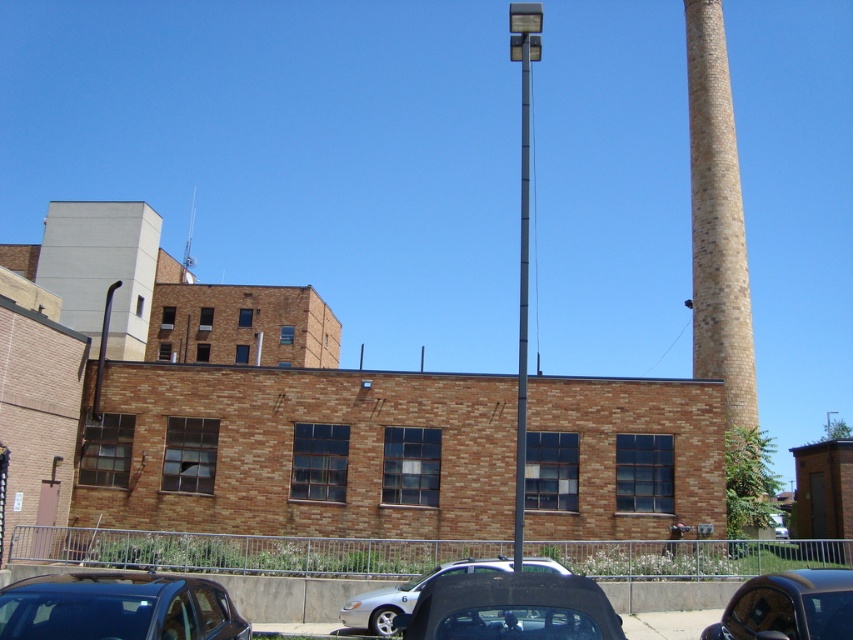
Question: Does shiny black car at lower right appear on the left side of metallic gray pole at center?

Choices:
 (A) yes
 (B) no

Answer: (A)

Question: Can you confirm if shiny black car at lower right is positioned to the right of metallic gray pole at center?

Choices:
 (A) yes
 (B) no

Answer: (B)

Question: Can you confirm if shiny blue car at lower left is positioned to the right of metallic gray pole at center?

Choices:
 (A) no
 (B) yes

Answer: (A)

Question: Which point is closer to the camera taking this photo?

Choices:
 (A) (384, 618)
 (B) (521, 244)
 (C) (793, 636)

Answer: (C)

Question: Estimate the real-world distances between objects in this image. Which object is farther from the shiny blue car at lower left?

Choices:
 (A) metallic gray pole at center
 (B) shiny black car at lower right

Answer: (A)

Question: Which object appears farthest from the camera in this image?

Choices:
 (A) matte black car at lower center
 (B) brick chimney at right
 (C) metallic gray pole at center
 (D) shiny black car at lower right

Answer: (B)